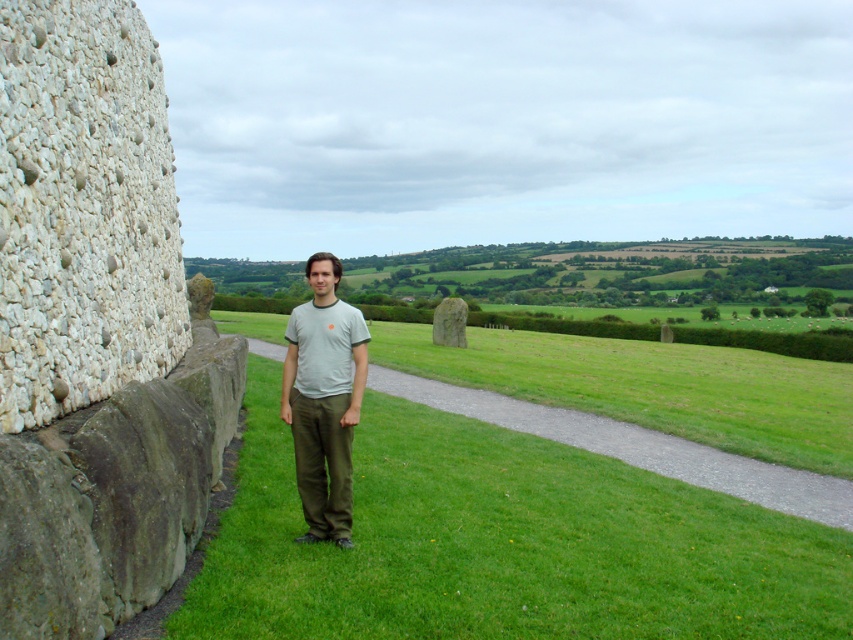
Question: Is green grass at center wider than gray cotton t-shirt at center?

Choices:
 (A) yes
 (B) no

Answer: (A)

Question: Does green grass at center have a greater width compared to gray cotton t-shirt at center?

Choices:
 (A) yes
 (B) no

Answer: (A)

Question: Can you confirm if green grass at center is positioned to the right of gray cotton t-shirt at center?

Choices:
 (A) no
 (B) yes

Answer: (B)

Question: Which of the following is the farthest from the observer?

Choices:
 (A) (834, 412)
 (B) (363, 385)

Answer: (A)

Question: Which of the following is the farthest from the observer?

Choices:
 (A) (260, 320)
 (B) (326, 403)

Answer: (A)

Question: Among these objects, which one is nearest to the camera?

Choices:
 (A) green grass at center
 (B) gray cotton t-shirt at center

Answer: (B)